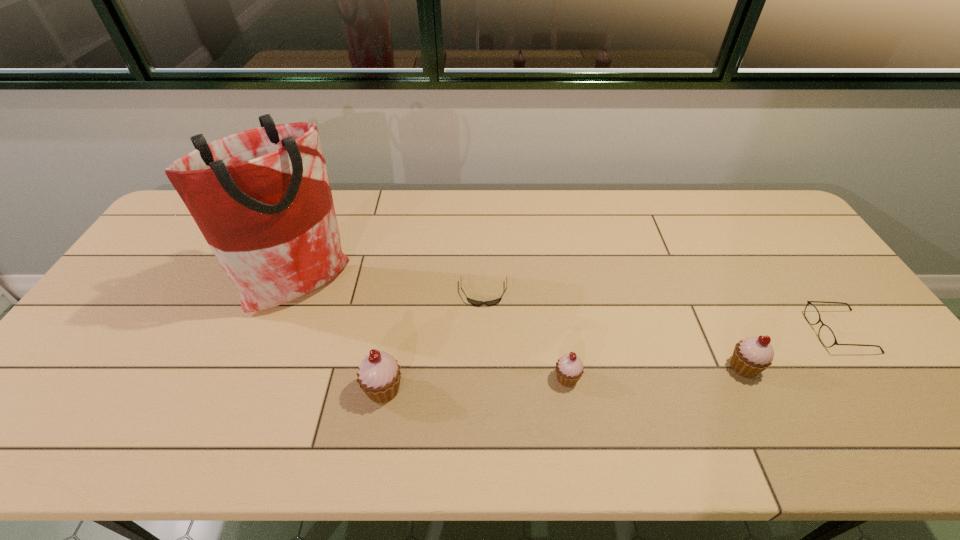
The width and height of the screenshot is (960, 540). What are the coordinates of `object present at the right edge` in the screenshot? It's located at (826, 336).

Identify the location of free space at the far edge. (569, 193).

In the image, there is a desktop. Identify the location of blank space at the near edge. The width and height of the screenshot is (960, 540). (201, 401).

The width and height of the screenshot is (960, 540). What are the coordinates of `vacant space at the left edge of the desktop` in the screenshot? It's located at (157, 305).

Identify the location of vacant space at the far left corner. (181, 223).

This screenshot has height=540, width=960. I want to click on vacant region at the far right corner, so click(758, 233).

Where is `blank region between the sunglasses and the second cupcake from right to left`? The width and height of the screenshot is (960, 540). blank region between the sunglasses and the second cupcake from right to left is located at coordinates (525, 336).

Find the location of `empty space that is in between the fourth tallest object and the spectacles`. empty space that is in between the fourth tallest object and the spectacles is located at coordinates (704, 355).

The width and height of the screenshot is (960, 540). Identify the location of vacant point located between the third tallest object and the third object from right to left. (656, 373).

Find the location of a particular element. free space between the rightmost cupcake and the rightmost object is located at coordinates (792, 349).